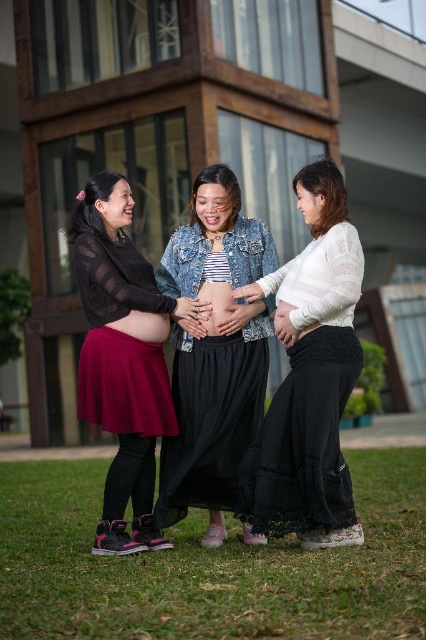
Question: Can you confirm if denim jacket at center is positioned below matte black belly at center?

Choices:
 (A) yes
 (B) no

Answer: (A)

Question: Which point is farther to the camera?

Choices:
 (A) denim jacket at center
 (B) green grass at lower center
 (C) matte black belly at center

Answer: (C)

Question: Based on their relative distances, which object is nearer to the denim jacket at center?

Choices:
 (A) burgundy knit skirt at left
 (B) green grass at lower center
 (C) matte black skirt at center
 (D) matte skin at center

Answer: (C)

Question: Is denim jacket at center smaller than burgundy knit skirt at left?

Choices:
 (A) yes
 (B) no

Answer: (B)

Question: Can you confirm if denim jacket at center is positioned below burgundy knit skirt at left?

Choices:
 (A) no
 (B) yes

Answer: (B)

Question: Which of the following is the closest to the observer?

Choices:
 (A) (169, 328)
 (B) (215, 317)
 (C) (199, 253)
 (D) (316, 476)

Answer: (D)